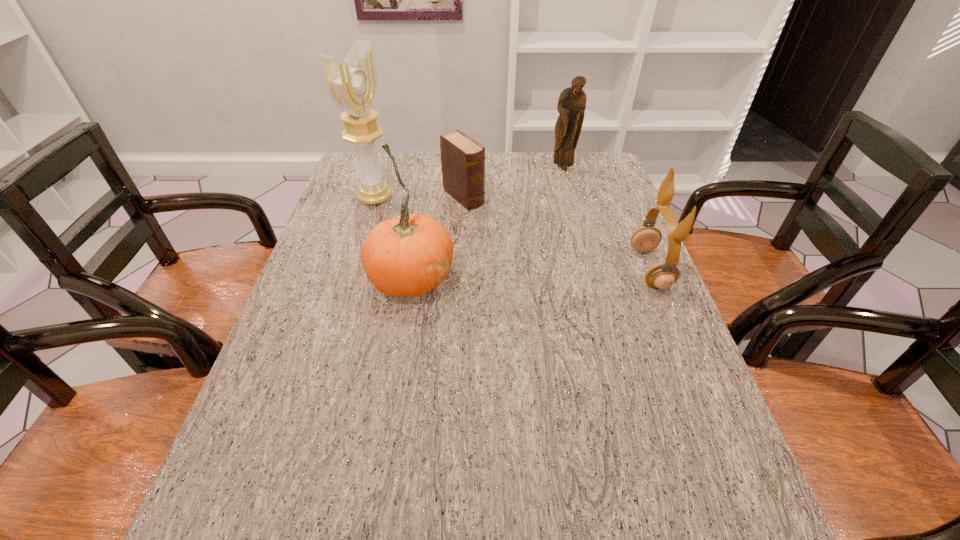
I want to click on free space on the desktop that is between the pumpkin and the fourth tallest object and is positioned on the front-facing side of the award, so click(564, 272).

The image size is (960, 540). What are the coordinates of `vacant space on the desktop that is between the pumpkin and the second shortest object and is positioned on the spine side of the diary` in the screenshot? It's located at (555, 272).

This screenshot has height=540, width=960. What are the coordinates of `free spot on the desktop that is between the pumpkin and the fourth tallest object and is positioned on the front-facing side of the farthest object` in the screenshot? It's located at (517, 273).